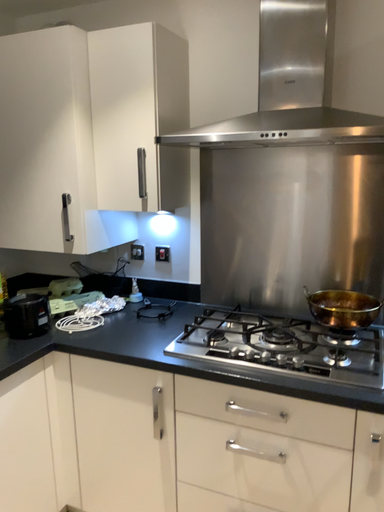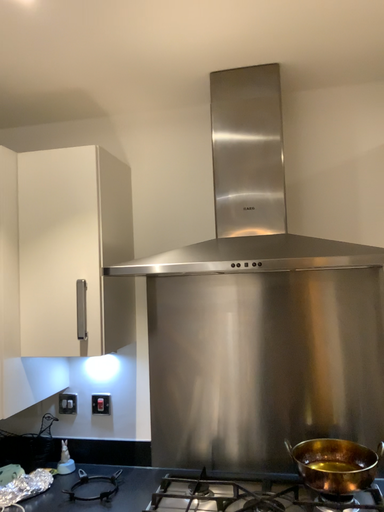
Question: Which way did the camera rotate in the video?

Choices:
 (A) rotated downward
 (B) rotated upward

Answer: (B)